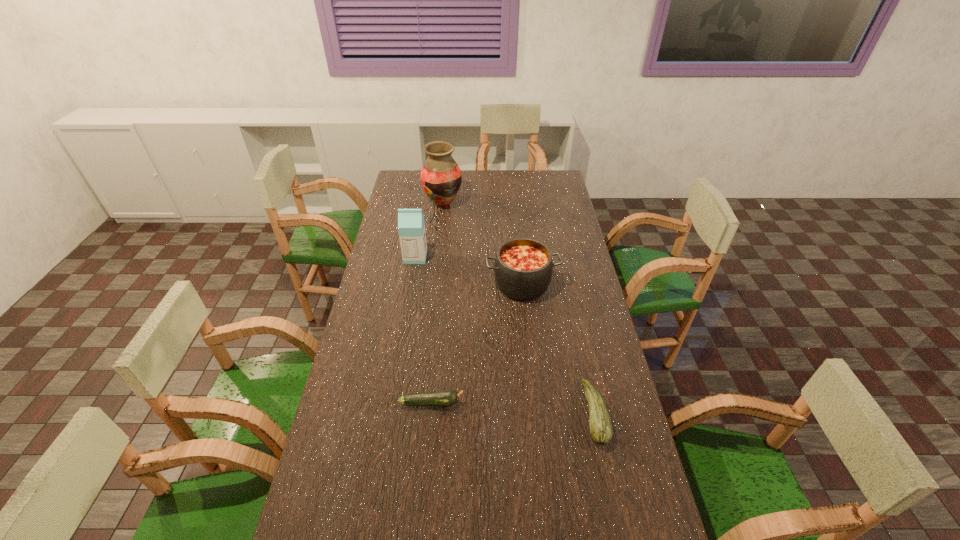
At what (x,y) coordinates should I click in order to perform the action: click on casserole present at the right edge. Please return your answer as a coordinate pair (x, y). This screenshot has width=960, height=540. Looking at the image, I should click on (523, 268).

Find the location of a particular element. Image resolution: width=960 pixels, height=540 pixels. zucchini that is at the right edge is located at coordinates (601, 431).

Locate an element on the screen. object located at the far left corner is located at coordinates (441, 177).

In the image, there is a desktop. What are the coordinates of `vacant region at the far edge` in the screenshot? It's located at (472, 174).

In the image, there is a desktop. What are the coordinates of `vacant space at the left edge` in the screenshot? It's located at (393, 271).

In the image, there is a desktop. Identify the location of vacant space at the right edge. The width and height of the screenshot is (960, 540). (612, 418).

This screenshot has height=540, width=960. I want to click on vacant space at the far left corner of the desktop, so click(x=415, y=186).

You are a GUI agent. You are given a task and a screenshot of the screen. Output one action in this format:
    pyautogui.click(x=<x>, y=<y>)
    Task: Click on the empty location between the fourth nearest object and the casserole
    This screenshot has height=540, width=960.
    Given the screenshot: What is the action you would take?
    pyautogui.click(x=468, y=271)

Where is `vacant area that lies between the third farthest object and the taller zucchini`? vacant area that lies between the third farthest object and the taller zucchini is located at coordinates (559, 349).

Image resolution: width=960 pixels, height=540 pixels. What are the coordinates of `free space between the vase and the third shortest object` in the screenshot? It's located at click(x=483, y=244).